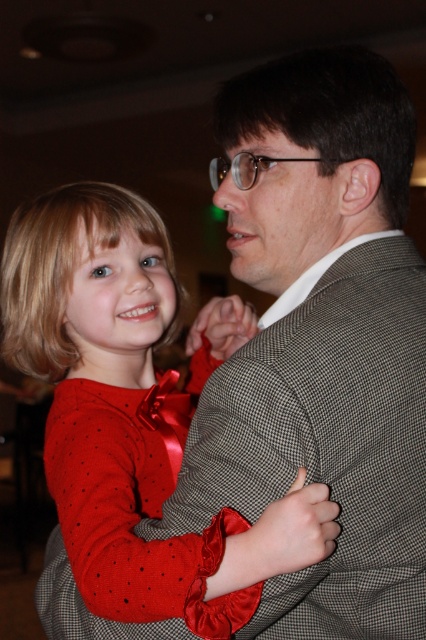
Is red satin dress at center thinner than clear plastic glasses at center?

No.

Can you confirm if red satin dress at center is shorter than clear plastic glasses at center?

No, red satin dress at center is not shorter than clear plastic glasses at center.

Does point (77, 532) come behind point (218, 168)?

No, (77, 532) is closer to viewer.

This screenshot has height=640, width=426. I want to click on red satin dress at center, so click(135, 502).

Consider the image. Measure the distance between matte red dress at center and camera.

matte red dress at center and camera are 25.54 inches apart.

In the scene shown: Can you confirm if matte red dress at center is taller than red satin dress at center?

Correct, matte red dress at center is much taller as red satin dress at center.

This screenshot has height=640, width=426. I want to click on matte red dress at center, so [x=135, y=413].

Does matte red dress at center appear on the right side of clear plastic glasses at center?

No, matte red dress at center is not to the right of clear plastic glasses at center.

Image resolution: width=426 pixels, height=640 pixels. Describe the element at coordinates (135, 413) in the screenshot. I see `matte red dress at center` at that location.

Is point (109, 552) farther from viewer compared to point (301, 157)?

No.

Locate an element on the screen. The image size is (426, 640). matte red dress at center is located at coordinates (135, 413).